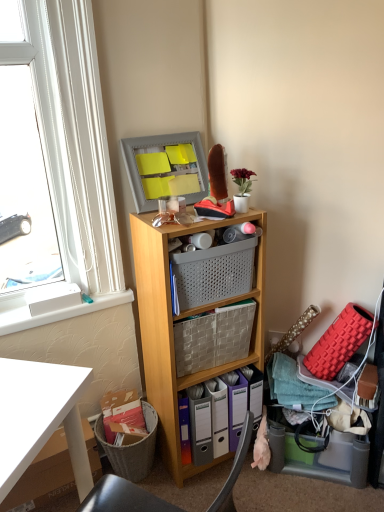
Describe the element at coordinates (213, 337) in the screenshot. This screenshot has height=512, width=384. I see `woven fabric basket at center, positioned as the second basket in top-to-bottom order` at that location.

Describe the element at coordinates (318, 454) in the screenshot. I see `translucent plastic storage box at lower right` at that location.

Measure the distance between point (x=81, y=250) and camera.

Point (x=81, y=250) is 1.61 meters away from camera.

At what (x,y) coordinates should I click in order to perform the action: click on white plastic window at upper left. Please return your answer as a coordinate pair (x, y). The image size is (384, 512). Looking at the image, I should click on (73, 159).

What do you see at coordinates (53, 311) in the screenshot? Image resolution: width=384 pixels, height=512 pixels. I see `white plastic window sill at upper left` at bounding box center [53, 311].

Where is `woven fabric basket at center, positioned as the second basket in top-to-bottom order`? This screenshot has height=512, width=384. woven fabric basket at center, positioned as the second basket in top-to-bottom order is located at coordinates (213, 337).

Considering the relative sizes of gray perforated basket at center, which appears as the first basket when viewed from the top, and white plastic window sill at upper left in the image provided, is gray perforated basket at center, which appears as the first basket when viewed from the top, smaller than white plastic window sill at upper left?

No.

Which object is positioned more to the right, gray perforated basket at center, which appears as the first basket when viewed from the top, or white plastic window sill at upper left?

Positioned to the right is gray perforated basket at center, which appears as the first basket when viewed from the top.

From a real-world perspective, between gray perforated basket at center, which is counted as the 2th basket, starting from the bottom, and white plastic window sill at upper left, who is vertically higher?

From a 3D spatial view, gray perforated basket at center, which is counted as the 2th basket, starting from the bottom, is above.

Would you say white cardboard box at lower left is to the left or to the right of white plastic window at upper left in the picture?

From the image, it's evident that white cardboard box at lower left is to the left of white plastic window at upper left.

Do you think white cardboard box at lower left is within white plastic window at upper left, or outside of it?

white cardboard box at lower left cannot be found inside white plastic window at upper left.

From the image's perspective, which is below, white cardboard box at lower left or white plastic window at upper left?

white cardboard box at lower left, from the image's perspective.

In terms of width, does translucent plastic storage box at lower right look wider or thinner when compared to white cardboard box at lower left?

In the image, translucent plastic storage box at lower right appears to be more narrow than white cardboard box at lower left.

At what (x,y) coordinates should I click in order to perform the action: click on storage box located below the white cardboard box at lower left (from the image's perspective). Please return your answer as a coordinate pair (x, y). The image size is (384, 512). Looking at the image, I should click on (318, 454).

Is white cardboard box at lower left at the back of translucent plastic storage box at lower right?

No, translucent plastic storage box at lower right is not facing the opposite direction of white cardboard box at lower left.

From the image's perspective, which basket is the 1st one above the wooden shelf at center? Please provide its 2D coordinates.

[(213, 337)]

From a real-world perspective, which object stands above the other?

woven fabric basket at center, positioned as the second basket in top-to-bottom order.

Which of these two, wooden shelf at center or woven fabric basket at center, positioned as the second basket in top-to-bottom order, is smaller?

woven fabric basket at center, positioned as the second basket in top-to-bottom order.

How much distance is there between wooden shelf at center and woven fabric basket at center, positioned as the second basket in top-to-bottom order?

5.15 inches.

The image size is (384, 512). What are the coordinates of `storage box on the right of wooden shelf at center` in the screenshot? It's located at click(x=318, y=454).

Does wooden shelf at center have a greater height compared to translucent plastic storage box at lower right?

Yes.

Is wooden shelf at center facing towards translucent plastic storage box at lower right?

No, wooden shelf at center is not turned towards translucent plastic storage box at lower right.

Is wooden shelf at center next to translucent plastic storage box at lower right and touching it?

No, wooden shelf at center is not with translucent plastic storage box at lower right.

Is wooden shelf at center at the back of woven fabric basket at center, positioned as the second basket in top-to-bottom order?

Yes, wooden shelf at center is at the back of woven fabric basket at center, positioned as the second basket in top-to-bottom order.

From the image's perspective, is woven fabric basket at center, positioned as the 1th basket in bottom-to-top order, located above or below wooden shelf at center?

woven fabric basket at center, positioned as the 1th basket in bottom-to-top order, is above wooden shelf at center.

Considering the relative sizes of woven fabric basket at center, positioned as the 1th basket in bottom-to-top order, and wooden shelf at center in the image provided, is woven fabric basket at center, positioned as the 1th basket in bottom-to-top order, bigger than wooden shelf at center?

No.

Is woven fabric basket at center, positioned as the second basket in top-to-bottom order, spatially inside wooden shelf at center, or outside of it?

woven fabric basket at center, positioned as the second basket in top-to-bottom order, is inside wooden shelf at center.

Locate an element on the screen. The image size is (384, 512). window above the woven fabric basket at center, positioned as the second basket in top-to-bottom order (from a real-world perspective) is located at coordinates (73, 159).

Does white plastic window at upper left lie in front of woven fabric basket at center, positioned as the second basket in top-to-bottom order?

Yes, white plastic window at upper left is in front of woven fabric basket at center, positioned as the second basket in top-to-bottom order.

Between white plastic window at upper left and woven fabric basket at center, positioned as the second basket in top-to-bottom order, which one has smaller width?

With smaller width is white plastic window at upper left.

Based on the photo, from the image's perspective, which is above, white plastic window at upper left or woven fabric basket at center, positioned as the second basket in top-to-bottom order?

white plastic window at upper left.

Where is `basket above the white plastic window sill at upper left (from the image's perspective)`? The image size is (384, 512). basket above the white plastic window sill at upper left (from the image's perspective) is located at coordinates (214, 272).

The image size is (384, 512). What are the coordinates of `box in front of the white plastic window at upper left` in the screenshot? It's located at (44, 476).

Estimate the real-world distances between objects in this image. Which object is further from woven fabric basket at center, positioned as the 1th basket in bottom-to-top order, white plastic window sill at upper left or translucent plastic storage box at lower right?

Among the two, translucent plastic storage box at lower right is located further to woven fabric basket at center, positioned as the 1th basket in bottom-to-top order.

Based on their spatial positions, is translucent plastic storage box at lower right or gray perforated basket at center, which is counted as the 2th basket, starting from the bottom, further from white cardboard box at lower left?

Based on the image, translucent plastic storage box at lower right appears to be further to white cardboard box at lower left.

When comparing their distances from translucent plastic storage box at lower right, does white plastic window at upper left or wooden shelf at center seem closer?

wooden shelf at center is closer to translucent plastic storage box at lower right.

From the image, which object appears to be nearer to wooden shelf at center, translucent plastic storage box at lower right or white cardboard box at lower left?

Based on the image, translucent plastic storage box at lower right appears to be nearer to wooden shelf at center.

Looking at this image, from the image, which object appears to be nearer to translucent plastic storage box at lower right, white cardboard box at lower left or white plastic window sill at upper left?

Based on the image, white cardboard box at lower left appears to be nearer to translucent plastic storage box at lower right.

Looking at the image, which one is located further to woven fabric basket at center, positioned as the 1th basket in bottom-to-top order, white cardboard box at lower left or translucent plastic storage box at lower right?

The object further to woven fabric basket at center, positioned as the 1th basket in bottom-to-top order, is white cardboard box at lower left.

When comparing their distances from gray perforated basket at center, which is counted as the 2th basket, starting from the bottom, does white plastic window at upper left or wooden shelf at center seem closer?

Among the two, wooden shelf at center is located nearer to gray perforated basket at center, which is counted as the 2th basket, starting from the bottom.

Based on their spatial positions, is white cardboard box at lower left or white plastic window at upper left further from woven fabric basket at center, positioned as the second basket in top-to-bottom order?

white cardboard box at lower left lies further to woven fabric basket at center, positioned as the second basket in top-to-bottom order, than the other object.

Locate an element on the screen. This screenshot has height=512, width=384. basket located between white plastic window sill at upper left and gray perforated basket at center, which is counted as the 2th basket, starting from the bottom, in the left-right direction is located at coordinates (213, 337).

At what (x,y) coordinates should I click in order to perform the action: click on basket between gray perforated basket at center, which is counted as the 2th basket, starting from the bottom, and wooden shelf at center from top to bottom. Please return your answer as a coordinate pair (x, y). The height and width of the screenshot is (512, 384). Looking at the image, I should click on (213, 337).

Find the location of a particular element. window sill that lies between white plastic window at upper left and wooden shelf at center from top to bottom is located at coordinates (53, 311).

Find the location of a particular element. shelf between gray perforated basket at center, which appears as the first basket when viewed from the top, and translucent plastic storage box at lower right vertically is located at coordinates (181, 319).